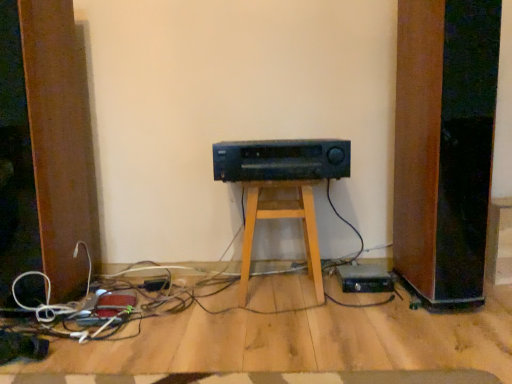
Question: Is wooden stool at center positioned before black plastic amplifier at center?

Choices:
 (A) yes
 (B) no

Answer: (B)

Question: Considering the relative sizes of wooden stool at center and black plastic amplifier at center in the image provided, is wooden stool at center shorter than black plastic amplifier at center?

Choices:
 (A) no
 (B) yes

Answer: (A)

Question: Would you consider wooden stool at center to be distant from black plastic amplifier at center?

Choices:
 (A) no
 (B) yes

Answer: (A)

Question: Would you say wooden stool at center contains black plastic amplifier at center?

Choices:
 (A) yes
 (B) no

Answer: (B)

Question: From the image's perspective, is wooden stool at center located beneath black plastic amplifier at center?

Choices:
 (A) yes
 (B) no

Answer: (A)

Question: Considering the relative positions of wooden stool at center and black plastic amplifier at center in the image provided, is wooden stool at center to the right of black plastic amplifier at center from the viewer's perspective?

Choices:
 (A) yes
 (B) no

Answer: (B)

Question: From a real-world perspective, does black plastic amplifier at center stand above wooden stool at center?

Choices:
 (A) yes
 (B) no

Answer: (A)

Question: Does black plastic amplifier at center appear on the right side of wooden stool at center?

Choices:
 (A) no
 (B) yes

Answer: (B)

Question: Does black plastic amplifier at center have a greater height compared to wooden stool at center?

Choices:
 (A) no
 (B) yes

Answer: (A)

Question: Is black plastic amplifier at center positioned far away from wooden stool at center?

Choices:
 (A) yes
 (B) no

Answer: (B)

Question: From a real-world perspective, does black plastic amplifier at center sit lower than wooden stool at center?

Choices:
 (A) yes
 (B) no

Answer: (B)

Question: Is wooden stool at center at the back of black plastic amplifier at center?

Choices:
 (A) yes
 (B) no

Answer: (B)

Question: In terms of size, does black plastic amplifier at center appear bigger or smaller than wooden stool at center?

Choices:
 (A) big
 (B) small

Answer: (B)